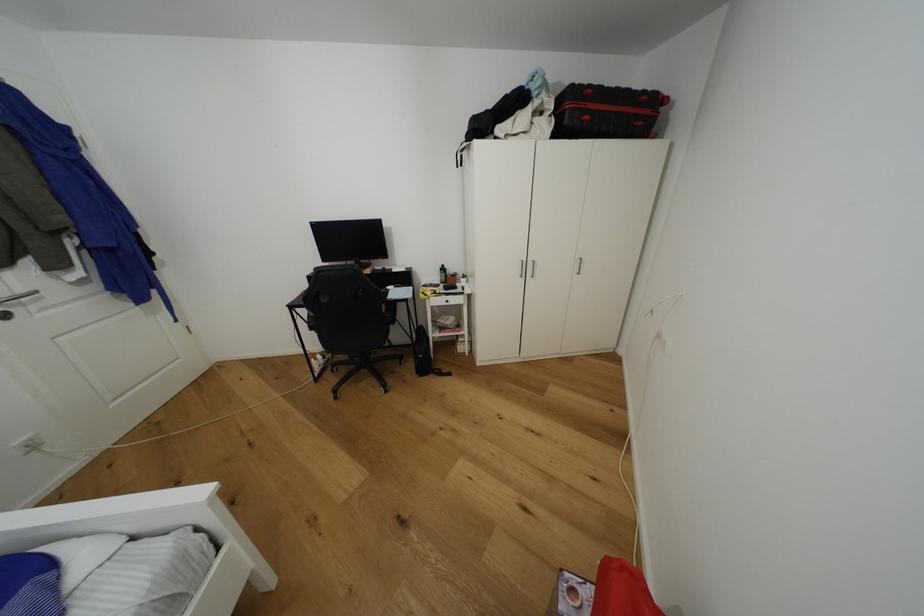
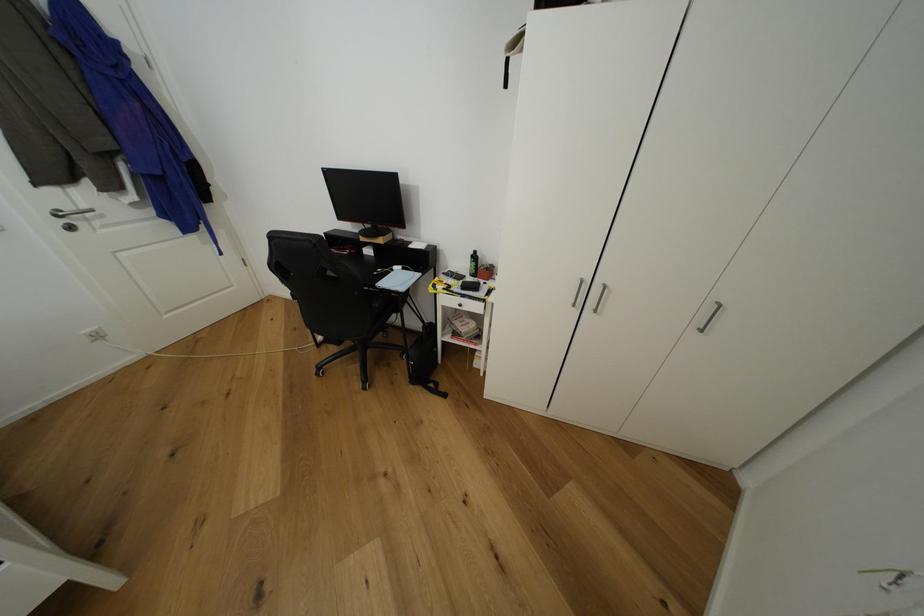
Locate, in the second image, the point that corresponds to point 453,318 in the first image.

(472, 322)